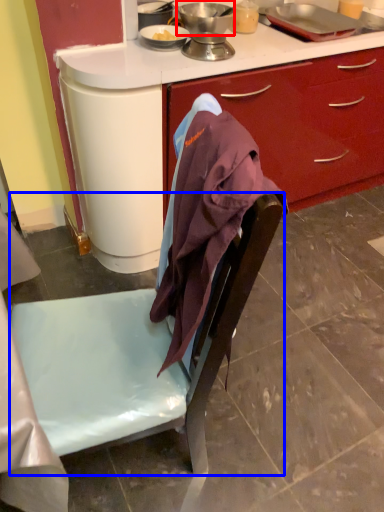
Question: Which object is closer to the camera taking this photo, kitchen appliance (highlighted by a red box) or chair (highlighted by a blue box)?

Choices:
 (A) kitchen appliance
 (B) chair

Answer: (B)